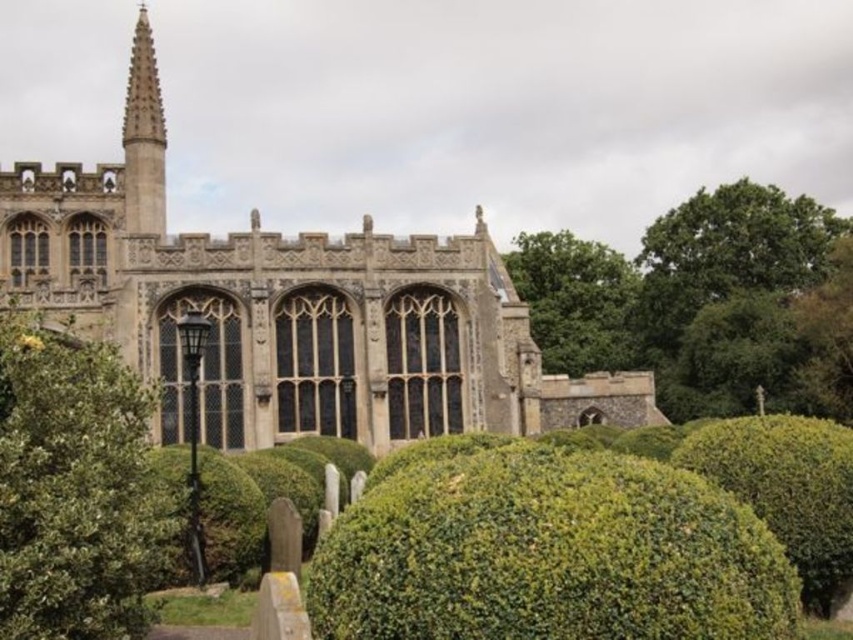
You are a gardener planning to replace the green leafy bush at center and the green leafy bush at lower right with new plants. If you want to maintain the current spacing between them, which bush should you choose a wider replacement for?

The green leafy bush at center is wider than the green leafy bush at lower right. To maintain the current spacing between them, you should choose a wider replacement for the green leafy bush at lower right so that both bushes have similar widths.